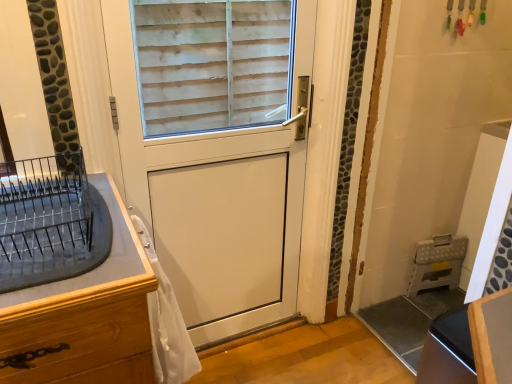
Question: Considering the relative sizes of white matte door at center and white plastic folding stool at lower right, the second appliance from the front, in the image provided, is white matte door at center taller than white plastic folding stool at lower right, the second appliance from the front,?

Choices:
 (A) no
 (B) yes

Answer: (B)

Question: Considering the relative positions of white matte door at center and white plastic folding stool at lower right, which ranks as the 2th appliance in left-to-right order, in the image provided, is white matte door at center to the right of white plastic folding stool at lower right, which ranks as the 2th appliance in left-to-right order, from the viewer's perspective?

Choices:
 (A) no
 (B) yes

Answer: (A)

Question: Could you tell me if white matte door at center is facing white plastic folding stool at lower right, the 2th appliance from the top?

Choices:
 (A) no
 (B) yes

Answer: (A)

Question: Does white matte door at center lie in front of white plastic folding stool at lower right, the second appliance from the front?

Choices:
 (A) no
 (B) yes

Answer: (B)

Question: Is white matte door at center beside white plastic folding stool at lower right, the first appliance when ordered from back to front?

Choices:
 (A) yes
 (B) no

Answer: (B)

Question: From a real-world perspective, is white matte door at center on white plastic folding stool at lower right, marked as the first appliance in a bottom-to-top arrangement?

Choices:
 (A) yes
 (B) no

Answer: (A)

Question: Considering the relative sizes of white sheer fabric at lower left and black metal dish rack at left, the first appliance from the top, in the image provided, is white sheer fabric at lower left thinner than black metal dish rack at left, the first appliance from the top,?

Choices:
 (A) no
 (B) yes

Answer: (B)

Question: Can you confirm if white sheer fabric at lower left is taller than black metal dish rack at left, which appears as the second appliance when viewed from the right?

Choices:
 (A) no
 (B) yes

Answer: (B)

Question: Could black metal dish rack at left, the first appliance from the top, be considered to be inside white sheer fabric at lower left?

Choices:
 (A) yes
 (B) no

Answer: (B)

Question: Considering the relative sizes of white sheer fabric at lower left and black metal dish rack at left, the 1th appliance positioned from the front, in the image provided, is white sheer fabric at lower left bigger than black metal dish rack at left, the 1th appliance positioned from the front,?

Choices:
 (A) yes
 (B) no

Answer: (B)

Question: Can you confirm if white sheer fabric at lower left is positioned to the left of black metal dish rack at left, the first appliance from the top?

Choices:
 (A) yes
 (B) no

Answer: (B)

Question: From a real-world perspective, is white sheer fabric at lower left under black metal dish rack at left, the 1th appliance positioned from the front?

Choices:
 (A) yes
 (B) no

Answer: (A)

Question: Considering the relative sizes of black metal dish rack at left, which is counted as the 2th appliance, starting from the back, and white sheer fabric at lower left in the image provided, is black metal dish rack at left, which is counted as the 2th appliance, starting from the back, bigger than white sheer fabric at lower left?

Choices:
 (A) yes
 (B) no

Answer: (A)